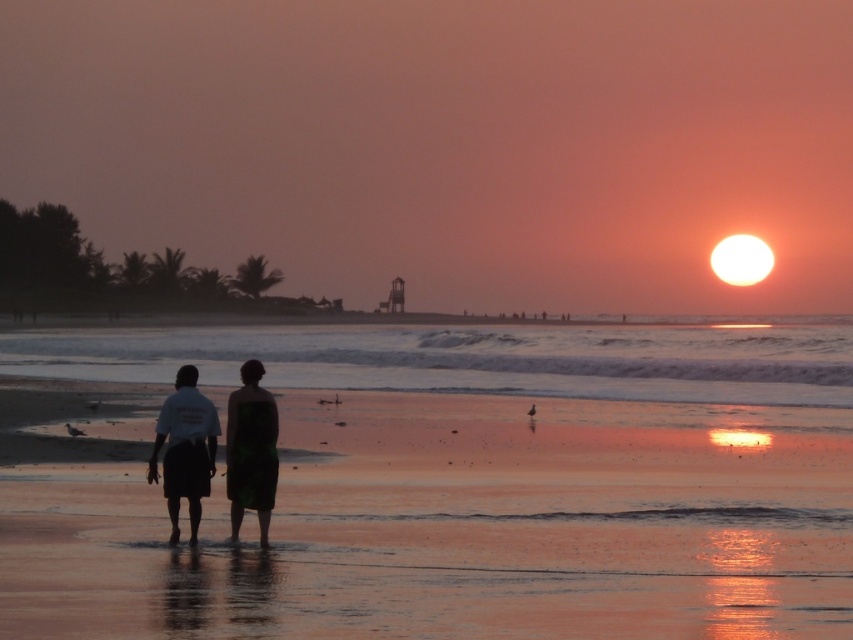
Question: Considering the relative positions of smooth sand at center and green textured towel at center in the image provided, where is smooth sand at center located with respect to green textured towel at center?

Choices:
 (A) right
 (B) left

Answer: (A)

Question: Does smooth sand at center lie behind green textured towel at center?

Choices:
 (A) no
 (B) yes

Answer: (A)

Question: Which point is closer to the camera taking this photo?

Choices:
 (A) tap(276, 424)
 (B) tap(344, 480)

Answer: (A)

Question: Does reflective wet sand at center appear over green textured towel at center?

Choices:
 (A) no
 (B) yes

Answer: (B)

Question: Estimate the real-world distances between objects in this image. Which object is closer to the silhouette shorts at center?

Choices:
 (A) green textured towel at center
 (B) reflective wet sand at center
 (C) smooth sand at center

Answer: (A)

Question: Which of the following is the farthest from the observer?

Choices:
 (A) reflective wet sand at center
 (B) silhouette shorts at center
 (C) green textured towel at center
 (D) smooth sand at center

Answer: (C)